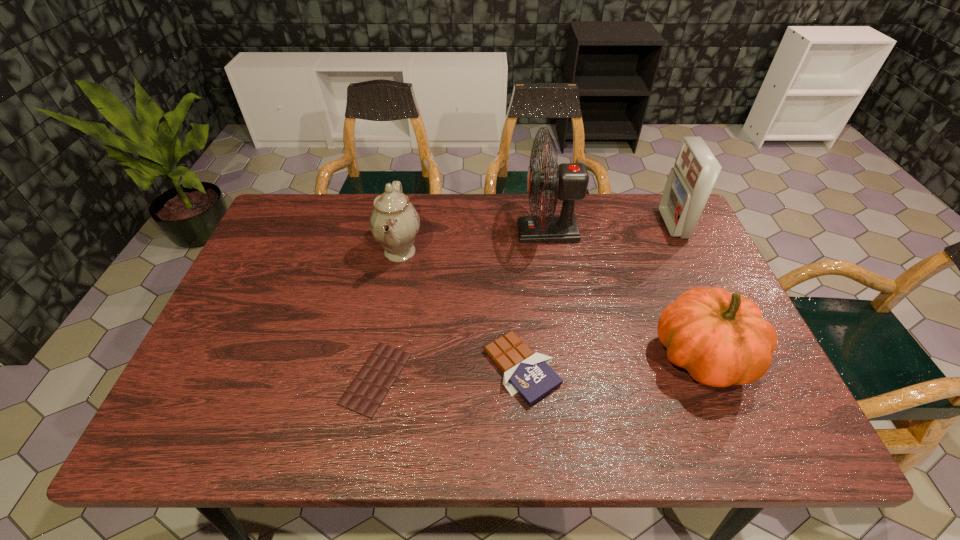
At what (x,y) coordinates should I click in order to perform the action: click on vacant area in the image that satisfies the following two spatial constraints: 1. on the spout of the taller chocolate bar; 2. on the right side of the chinaware. Please return your answer as a coordinate pair (x, y). Image resolution: width=960 pixels, height=540 pixels. Looking at the image, I should click on (378, 368).

The image size is (960, 540). Identify the location of vacant point that satisfies the following two spatial constraints: 1. on the spout of the chinaware; 2. on the left side of the pumpkin. (380, 357).

Find the location of a particular element. The width and height of the screenshot is (960, 540). free spot that satisfies the following two spatial constraints: 1. on the spout of the pumpkin; 2. on the left side of the chinaware is located at coordinates (380, 357).

At what (x,y) coordinates should I click in order to perform the action: click on free spot that satisfies the following two spatial constraints: 1. on the spout of the chinaware; 2. on the front side of the shortest object. Please return your answer as a coordinate pair (x, y). The height and width of the screenshot is (540, 960). Looking at the image, I should click on (376, 379).

Locate an element on the screen. This screenshot has height=540, width=960. blank area in the image that satisfies the following two spatial constraints: 1. on the spout of the chinaware; 2. on the back side of the right chocolate bar is located at coordinates (378, 368).